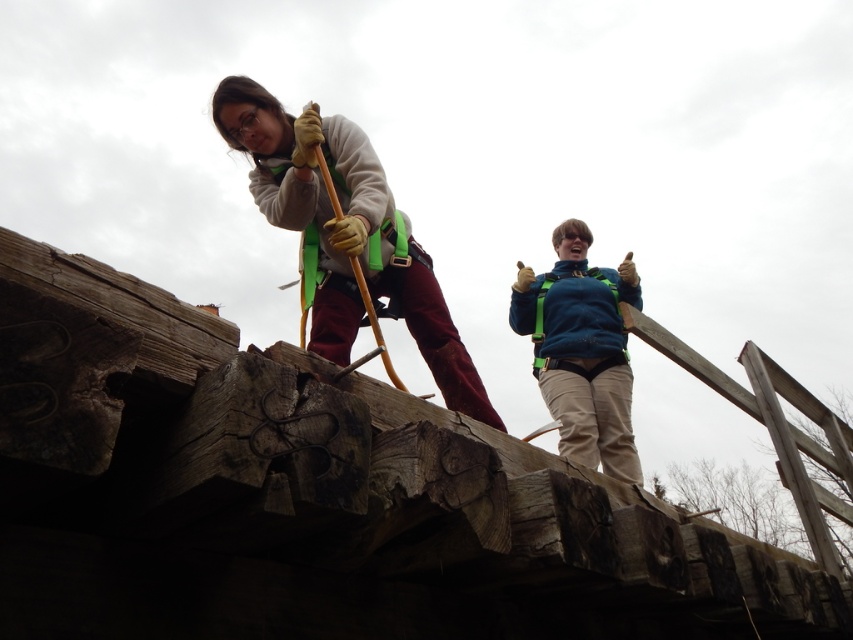
Describe the element at coordinates (346, 234) in the screenshot. I see `matte green safety harness at upper left` at that location.

Which is more to the right, matte green safety harness at upper left or teal fabric safety vest at upper center?

teal fabric safety vest at upper center

Is point (424, 323) positioned in front of point (544, 282)?

Yes, point (424, 323) is in front of point (544, 282).

Identify the location of matte green safety harness at upper left. (346, 234).

In the scene shown: Is matte green safety harness at upper left wider than blue fleece jacket at upper center?

Correct, the width of matte green safety harness at upper left exceeds that of blue fleece jacket at upper center.

Who is more forward, (399, 266) or (566, 241)?

Point (399, 266)

Where is `matte green safety harness at upper left`? The image size is (853, 640). matte green safety harness at upper left is located at coordinates (346, 234).

Which is below, blue fleece jacket at upper center or teal fabric safety vest at upper center?

blue fleece jacket at upper center

Is blue fleece jacket at upper center thinner than teal fabric safety vest at upper center?

No.

Where is `blue fleece jacket at upper center`? This screenshot has width=853, height=640. blue fleece jacket at upper center is located at coordinates (581, 349).